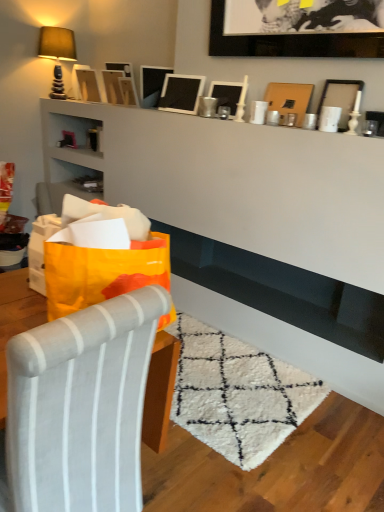
Question: Considering the relative sizes of orange paper bag at left and wooden picture frame at upper center, the third picture frame when ordered from left to right, in the image provided, is orange paper bag at left taller than wooden picture frame at upper center, the third picture frame when ordered from left to right,?

Choices:
 (A) yes
 (B) no

Answer: (A)

Question: Is orange paper bag at left positioned with its back to wooden picture frame at upper center, the 6th picture frame viewed from the right?

Choices:
 (A) no
 (B) yes

Answer: (A)

Question: Can you confirm if orange paper bag at left is thinner than wooden picture frame at upper center, the 6th picture frame viewed from the right?

Choices:
 (A) no
 (B) yes

Answer: (A)

Question: Considering the relative sizes of orange paper bag at left and wooden picture frame at upper center, the third picture frame when ordered from left to right, in the image provided, is orange paper bag at left bigger than wooden picture frame at upper center, the third picture frame when ordered from left to right,?

Choices:
 (A) no
 (B) yes

Answer: (B)

Question: Is the depth of orange paper bag at left less than that of wooden picture frame at upper center, the 6th picture frame viewed from the right?

Choices:
 (A) no
 (B) yes

Answer: (B)

Question: Looking at the image, does black matte picture frame at upper center, the seventh picture frame in the left-to-right sequence, seem bigger or smaller compared to orange paper bag at left?

Choices:
 (A) big
 (B) small

Answer: (B)

Question: Is black matte picture frame at upper center, arranged as the 2th picture frame when viewed from the right, inside the boundaries of orange paper bag at left, or outside?

Choices:
 (A) outside
 (B) inside

Answer: (A)

Question: In terms of width, does black matte picture frame at upper center, arranged as the 2th picture frame when viewed from the right, look wider or thinner when compared to orange paper bag at left?

Choices:
 (A) thin
 (B) wide

Answer: (A)

Question: From a real-world perspective, is black matte picture frame at upper center, the seventh picture frame in the left-to-right sequence, physically located above or below orange paper bag at left?

Choices:
 (A) above
 (B) below

Answer: (A)

Question: From the image's perspective, relative to metallic silver picture frame at upper center, positioned as the 3th picture frame in right-to-left order, is wooden picture frame at upper center, the third picture frame when ordered from left to right, above or below?

Choices:
 (A) below
 (B) above

Answer: (B)

Question: Looking at the image, does wooden picture frame at upper center, the third picture frame when ordered from left to right, seem bigger or smaller compared to metallic silver picture frame at upper center, positioned as the 3th picture frame in right-to-left order?

Choices:
 (A) big
 (B) small

Answer: (B)

Question: From a real-world perspective, is wooden picture frame at upper center, the third picture frame when ordered from left to right, positioned above or below metallic silver picture frame at upper center, positioned as the 3th picture frame in right-to-left order?

Choices:
 (A) below
 (B) above

Answer: (A)

Question: Considering the relative positions of wooden picture frame at upper center, the 6th picture frame viewed from the right, and metallic silver picture frame at upper center, arranged as the 6th picture frame when viewed from the left, in the image provided, is wooden picture frame at upper center, the 6th picture frame viewed from the right, to the left or to the right of metallic silver picture frame at upper center, arranged as the 6th picture frame when viewed from the left,?

Choices:
 (A) left
 (B) right

Answer: (A)

Question: Choose the correct answer: Is wooden picture frame at upper center, the 6th picture frame viewed from the right, inside matte black picture frame at upper left, which is the 1th picture frame in left-to-right order, or outside it?

Choices:
 (A) outside
 (B) inside

Answer: (A)

Question: Based on their sizes in the image, would you say wooden picture frame at upper center, the third picture frame when ordered from left to right, is bigger or smaller than matte black picture frame at upper left, which is the 1th picture frame in left-to-right order?

Choices:
 (A) big
 (B) small

Answer: (B)